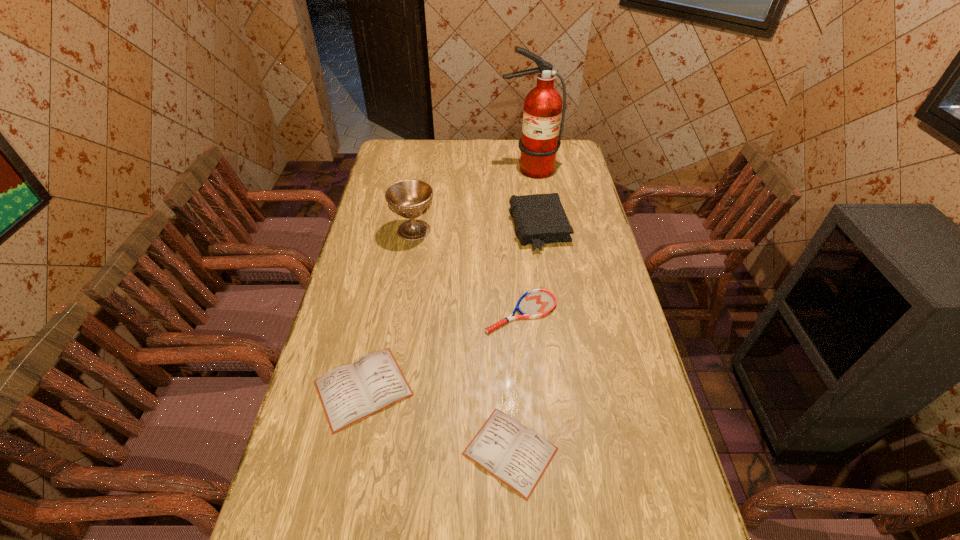
In order to click on object at the far right corner in this screenshot , I will do coord(543,104).

At what (x,y) coordinates should I click in order to perform the action: click on vacant area at the far edge of the desktop. Please return your answer as a coordinate pair (x, y). Looking at the image, I should click on (517, 151).

Identify the location of blank space at the near edge of the desktop. This screenshot has height=540, width=960. (359, 492).

In the image, there is a desktop. Identify the location of vacant space at the left edge. The height and width of the screenshot is (540, 960). (348, 354).

The height and width of the screenshot is (540, 960). What are the coordinates of `vacant space at the right edge of the desktop` in the screenshot? It's located at (609, 288).

I want to click on blank space at the far left corner of the desktop, so click(399, 142).

Find the location of a particular element. Image resolution: width=960 pixels, height=540 pixels. free space at the near left corner is located at coordinates (319, 509).

Image resolution: width=960 pixels, height=540 pixels. What are the coordinates of `free region at the far right corner of the desktop` in the screenshot? It's located at (564, 143).

Where is `vacant region between the third tallest object and the left diary`? The width and height of the screenshot is (960, 540). vacant region between the third tallest object and the left diary is located at coordinates (451, 308).

I want to click on empty space that is in between the taller diary and the chalice, so click(389, 309).